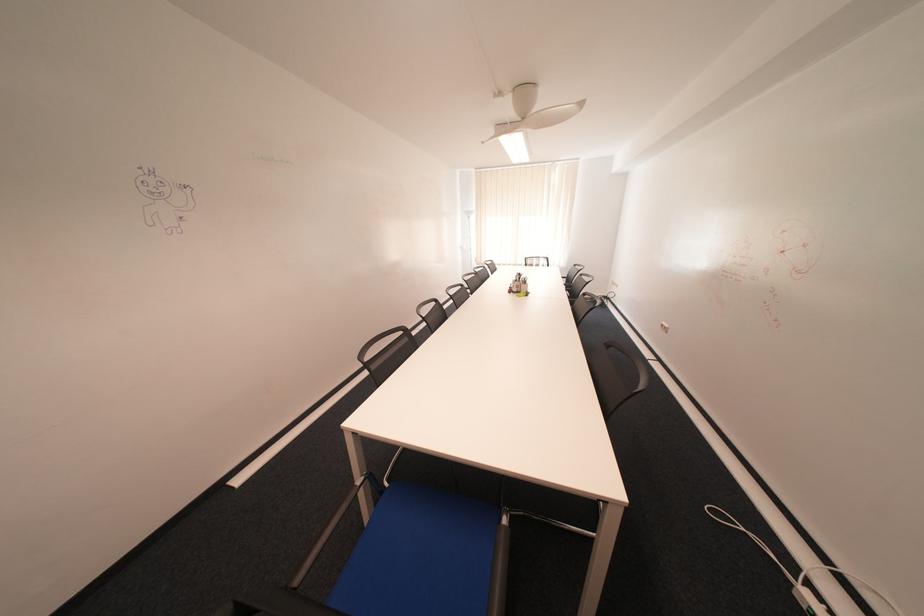
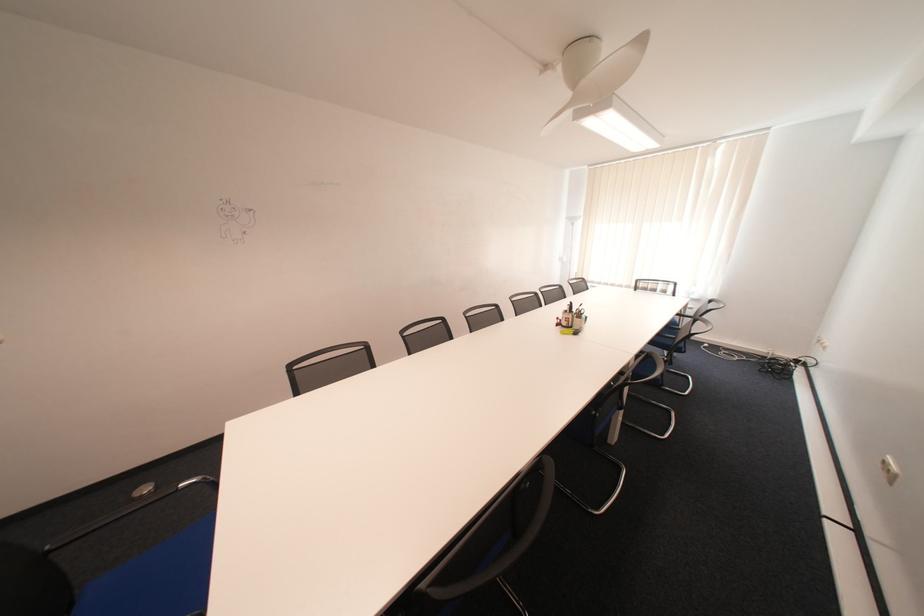
The point at (527,281) is marked in the first image. Where is the corresponding point in the second image?

(578, 312)